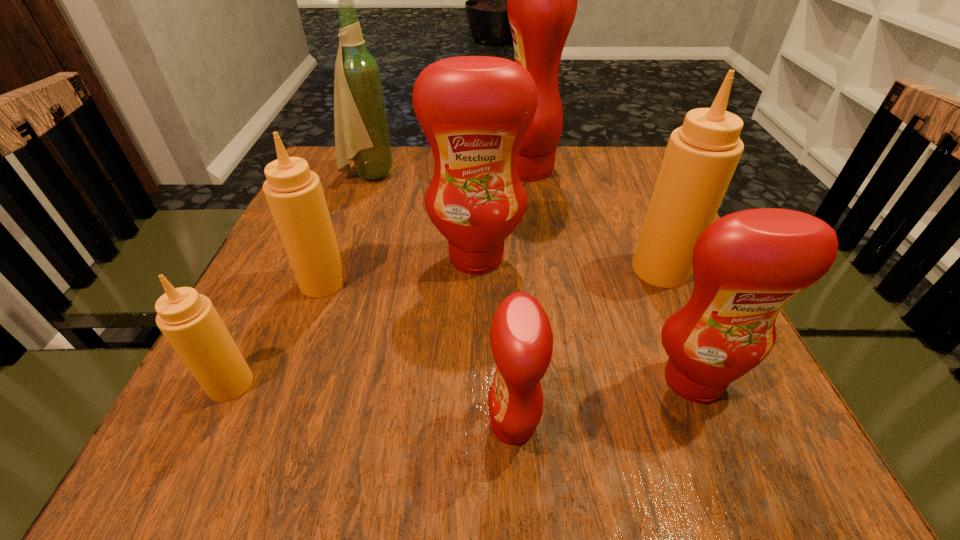
The height and width of the screenshot is (540, 960). Identify the location of the nearest tan condiment. (189, 321).

Identify the location of vacant space located 0.150m on the label side of the farthest red condiment. The width and height of the screenshot is (960, 540). (443, 170).

You are a GUI agent. You are given a task and a screenshot of the screen. Output one action in this format:
    pyautogui.click(x=<x>, y=<y>)
    Task: Click on the vacant space situated on the label side of the farthest red condiment
    The image size is (960, 540).
    Given the screenshot: What is the action you would take?
    pyautogui.click(x=389, y=170)

Identify the location of vacant region located on the label side of the farthest red condiment. This screenshot has width=960, height=540. (450, 170).

I want to click on free space located 0.200m on the front-facing side of the wine bottle, so click(x=473, y=176).

Where is `vacant space located 0.270m on the front of the rightmost tan condiment`? This screenshot has width=960, height=540. vacant space located 0.270m on the front of the rightmost tan condiment is located at coordinates (728, 421).

Where is `vacant area located 0.060m on the label side of the third smallest red condiment`? This screenshot has width=960, height=540. vacant area located 0.060m on the label side of the third smallest red condiment is located at coordinates (476, 301).

Identify the location of free space located 0.060m on the front of the sixth condiment from right to left. This screenshot has width=960, height=540. (308, 323).

Locate an element on the screen. This screenshot has height=540, width=960. free spot located on the label side of the rightmost red condiment is located at coordinates click(718, 441).

The image size is (960, 540). I want to click on vacant region located on the label side of the smallest red condiment, so click(340, 424).